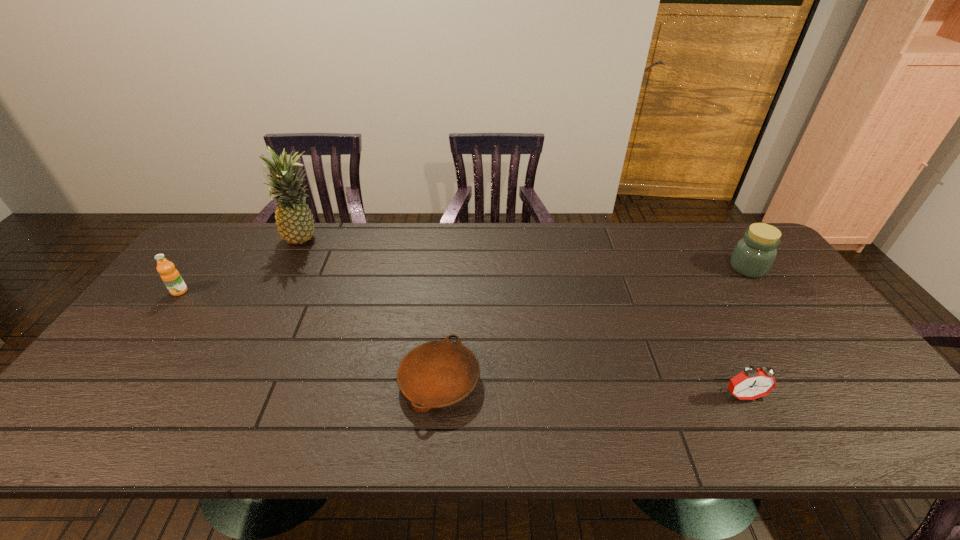
Find the location of a particular element. The height and width of the screenshot is (540, 960). vacant region located 0.180m on the left of the pineapple is located at coordinates (228, 240).

Where is `vacant space located 0.400m on the front of the rightmost object`? This screenshot has height=540, width=960. vacant space located 0.400m on the front of the rightmost object is located at coordinates (836, 392).

At what (x,y) coordinates should I click in order to perform the action: click on free point located on the label of the third nearest object. Please return your answer as a coordinate pair (x, y). Image resolution: width=960 pixels, height=540 pixels. Looking at the image, I should click on click(160, 316).

Find the location of a particular element. The height and width of the screenshot is (540, 960). vacant space located on the clock face of the alarm clock is located at coordinates (763, 436).

At what (x,y) coordinates should I click in order to perform the action: click on free spot located 0.280m on the right of the plate. Please return your answer as a coordinate pair (x, y). The image size is (960, 540). Looking at the image, I should click on (597, 381).

The height and width of the screenshot is (540, 960). I want to click on pineapple that is at the far edge, so click(294, 220).

At what (x,y) coordinates should I click in order to perform the action: click on jar positioned at the far edge. Please return your answer as a coordinate pair (x, y). Looking at the image, I should click on (753, 256).

You are a GUI agent. You are given a task and a screenshot of the screen. Output one action in this format:
    pyautogui.click(x=<x>, y=<y>)
    Task: Click on the object situated at the near edge
    
    Given the screenshot: What is the action you would take?
    pyautogui.click(x=436, y=374)

Find the location of a particular element. The image size is (960, 540). object that is at the left edge is located at coordinates (171, 277).

Where is `object present at the right edge`? object present at the right edge is located at coordinates (753, 256).